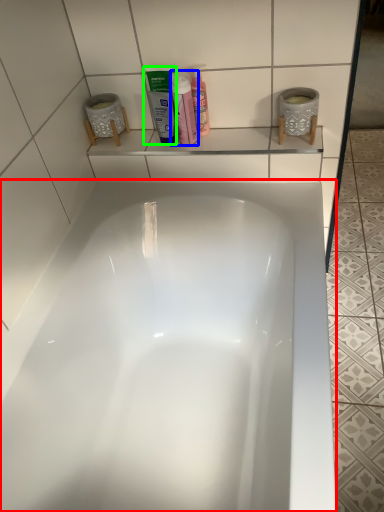
Question: Which is nearer to the bathtub (highlighted by a red box)? cleaning product (highlighted by a blue box) or mouthwash (highlighted by a green box).

Choices:
 (A) cleaning product
 (B) mouthwash

Answer: (B)